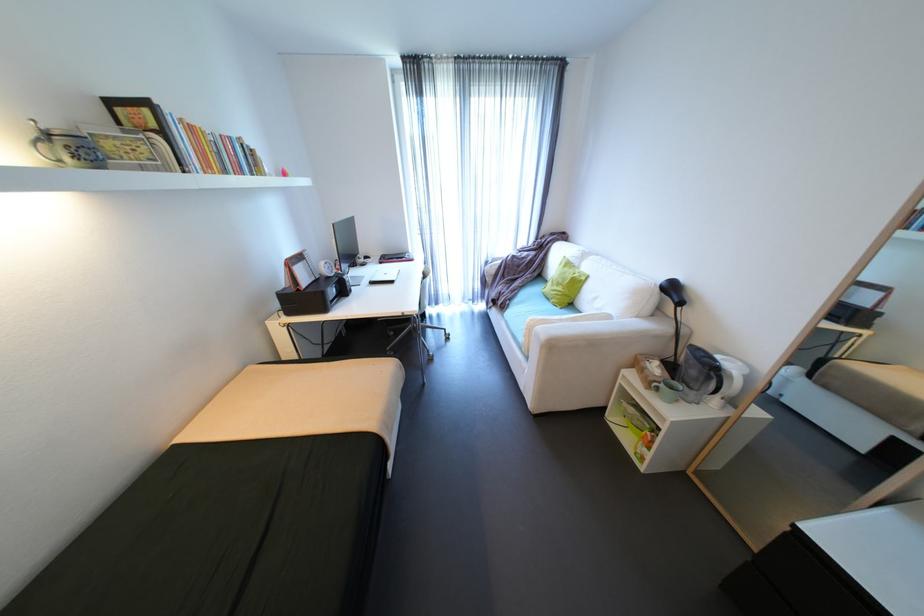
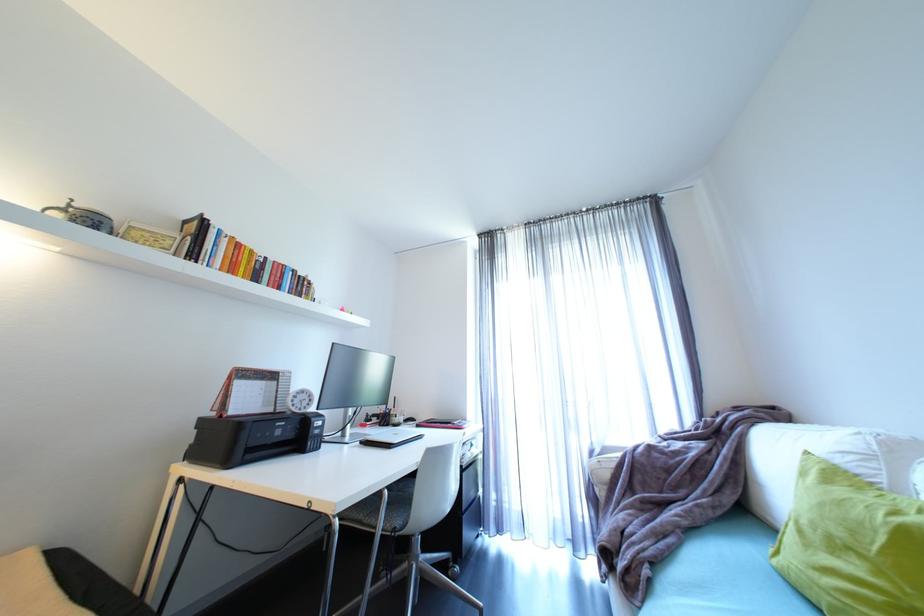
Where in the second image is the point corresponding to [570,289] from the first image?

(885, 573)